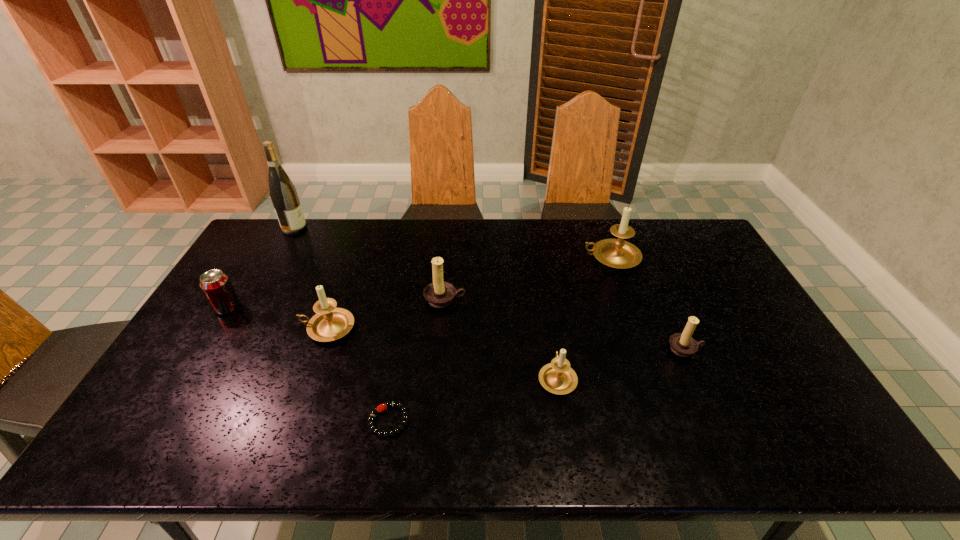
Image resolution: width=960 pixels, height=540 pixels. I want to click on free point located with a handle on the side of the third object from left to right, so click(202, 328).

Image resolution: width=960 pixels, height=540 pixels. I want to click on vacant space located with a handle on the side of the third object from left to right, so click(280, 328).

What are the coordinates of `vacant area situated 0.140m on the wick of the bigger brown candle holder` in the screenshot? It's located at (441, 346).

Locate an element on the screen. The image size is (960, 540). free spot located on the back of the soda can is located at coordinates (250, 270).

Identify the location of free space located with a handle on the side of the third object from right to left. (543, 291).

At what (x,y) coordinates should I click in order to perform the action: click on vacant area situated 0.200m with a handle on the side of the third object from right to left. Please return your answer as a coordinate pair (x, y). Image resolution: width=960 pixels, height=540 pixels. Looking at the image, I should click on (546, 308).

Image resolution: width=960 pixels, height=540 pixels. Identify the location of free spot located 0.200m with a handle on the side of the third object from right to left. (546, 308).

In order to click on free location located on the wick of the right brown candle holder in this screenshot , I will do `click(713, 411)`.

You are a GUI agent. You are given a task and a screenshot of the screen. Output one action in this format:
    pyautogui.click(x=<x>, y=<y>)
    Task: Click on the free point located on the left of the shortest object
    Image resolution: width=960 pixels, height=540 pixels.
    Given the screenshot: What is the action you would take?
    click(x=344, y=421)

Find the location of a particular element. The width and height of the screenshot is (960, 540). wine bottle that is at the far edge is located at coordinates (283, 194).